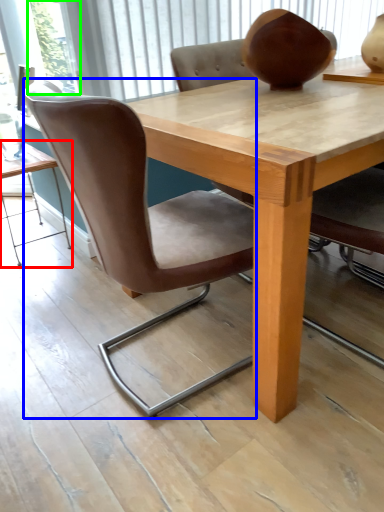
Question: Estimate the real-world distances between objects in this image. Which object is closer to table (highlighted by a red box), chair (highlighted by a blue box) or glass door (highlighted by a green box)?

Choices:
 (A) chair
 (B) glass door

Answer: (B)